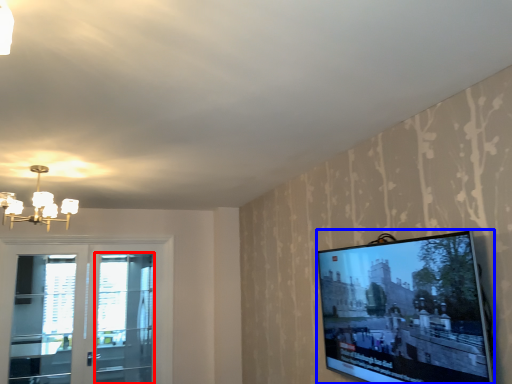
Question: Which object appears closest to the camera in this image, screen door (highlighted by a red box) or television (highlighted by a blue box)?

Choices:
 (A) screen door
 (B) television

Answer: (B)